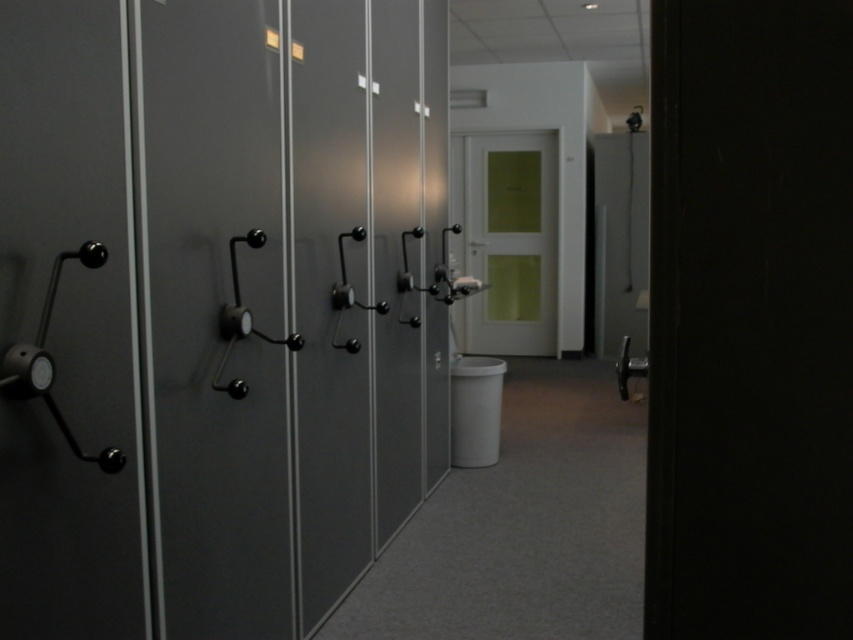
Question: Considering the real-world distances, which object is closest to the matte black cabinet at center?

Choices:
 (A) matte black door at left
 (B) matte gray door at center

Answer: (A)

Question: Which of the following is the farthest from the observer?

Choices:
 (A) matte black door handle at left
 (B) matte black cabinet at left

Answer: (B)

Question: Which point is closer to the camera taking this photo?

Choices:
 (A) (347, 444)
 (B) (119, 35)

Answer: (B)

Question: Is matte black door at left above matte black door handle at left?

Choices:
 (A) yes
 (B) no

Answer: (B)

Question: Does matte black cabinet at left lie behind matte black cabinet at center?

Choices:
 (A) yes
 (B) no

Answer: (B)

Question: Is matte black door at left to the right of matte black cabinet at center from the viewer's perspective?

Choices:
 (A) yes
 (B) no

Answer: (B)